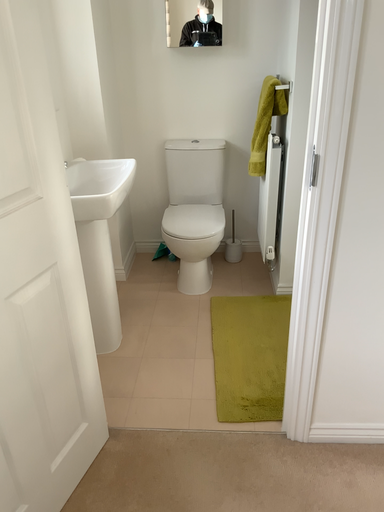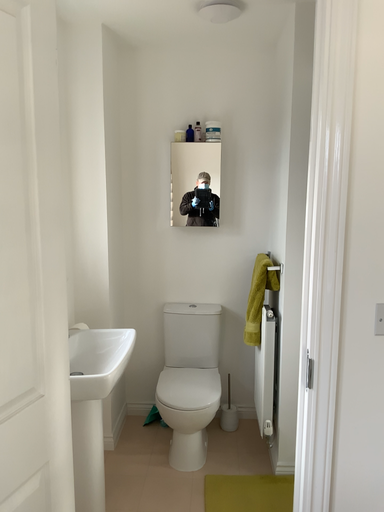
Question: Which way did the camera rotate in the video?

Choices:
 (A) rotated downward
 (B) rotated upward

Answer: (B)